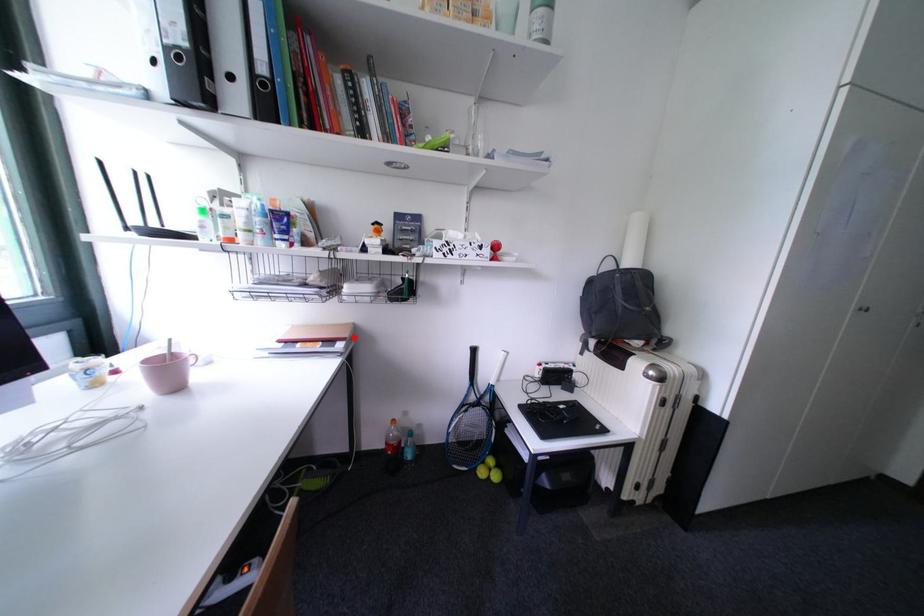
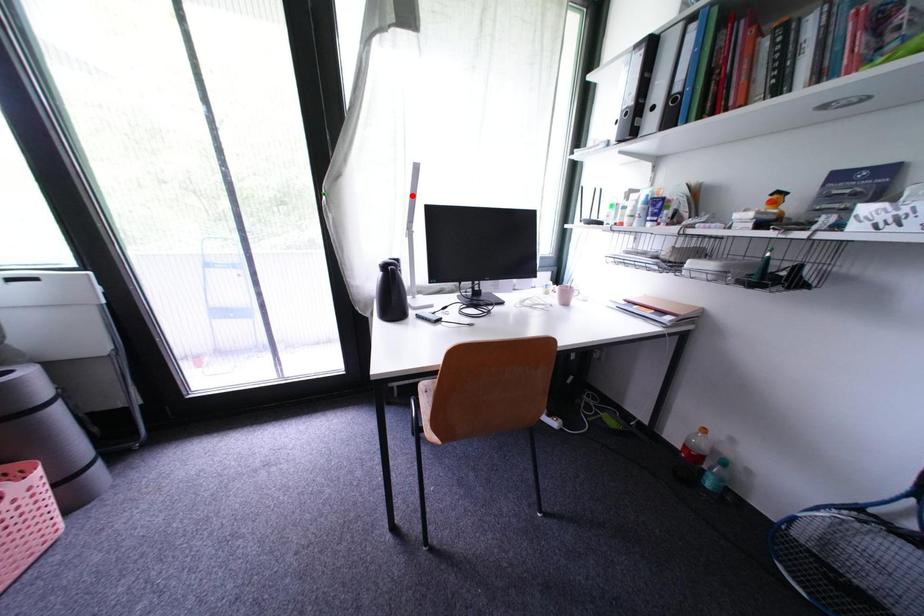
I am providing you with two images of the same scene from different viewpoints. A red point is marked on the first image and another point is marked on the second image. Does the point marked in image1 correspond to the same location as the one in image2?

No